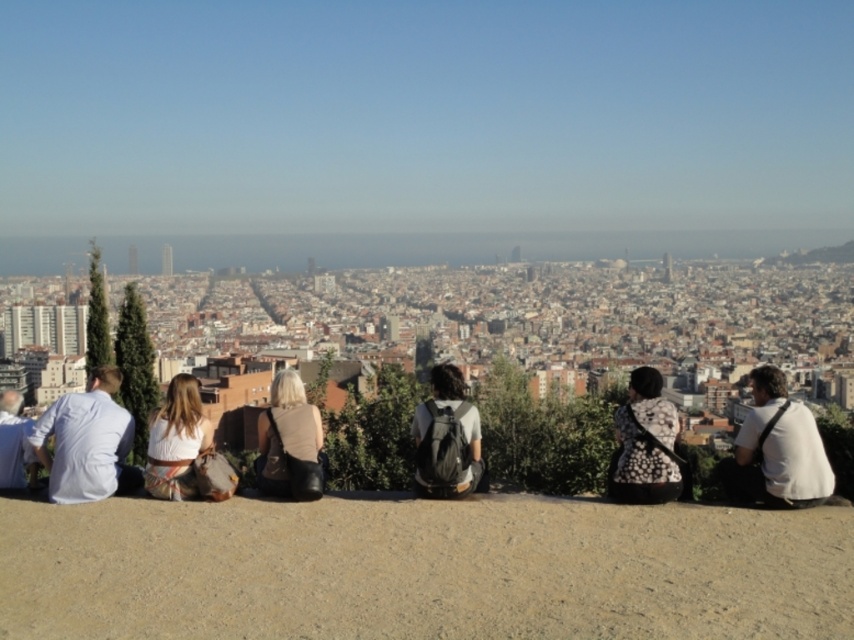
Question: Among these objects, which one is nearest to the camera?

Choices:
 (A) white fabric dress at center
 (B) floral-patterned blouse at center

Answer: (A)

Question: In this image, where is gray fabric backpack at center located relative to light beige fabric bag at center?

Choices:
 (A) left
 (B) right

Answer: (B)

Question: Does white fabric dress at center have a greater width compared to light blue shirt at left?

Choices:
 (A) no
 (B) yes

Answer: (A)

Question: Can you confirm if white shirt at left is positioned above floral-patterned blouse at center?

Choices:
 (A) no
 (B) yes

Answer: (B)

Question: Which object is the farthest from the white shirt at left?

Choices:
 (A) light beige fabric bag at center
 (B) light blue shirt at left
 (C) gray fabric backpack at center

Answer: (C)

Question: Which point appears closest to the camera in this image?

Choices:
 (A) (661, 445)
 (B) (104, 496)

Answer: (B)